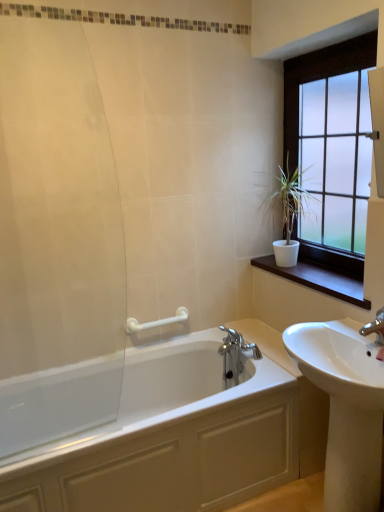
Measure the distance between point (320, 279) and camera.

The depth of point (320, 279) is 6.87 feet.

Measure the distance between white wood at right and camera.

white wood at right and camera are 5.83 feet apart.

Where is `transparent glass shower door at left`? transparent glass shower door at left is located at coordinates (56, 240).

What do you see at coordinates (56, 240) in the screenshot?
I see `transparent glass shower door at left` at bounding box center [56, 240].

Measure the distance between point [327,479] and camera.

Point [327,479] and camera are 1.69 meters apart from each other.

This screenshot has width=384, height=512. I want to click on white plastic grab bar at upper center, so click(x=156, y=321).

The width and height of the screenshot is (384, 512). What do you see at coordinates (170, 439) in the screenshot?
I see `white glossy bathtub at lower left` at bounding box center [170, 439].

Where is `satin glass window at upper right`? The width and height of the screenshot is (384, 512). satin glass window at upper right is located at coordinates (320, 78).

The height and width of the screenshot is (512, 384). Describe the element at coordinates (320, 78) in the screenshot. I see `satin glass window at upper right` at that location.

Locate an element on the screen. white matte plant at upper right is located at coordinates (290, 212).

From a real-world perspective, is white plastic grab bar at upper center physically below white glossy sink at right?

No, from a real-world perspective, white plastic grab bar at upper center is not below white glossy sink at right.

Is white plastic grab bar at upper center in front of or behind white glossy sink at right in the image?

white plastic grab bar at upper center is positioned farther from the viewer than white glossy sink at right.

How much distance is there between satin glass window at upper right and transparent glass shower door at left?

satin glass window at upper right is 4.43 feet from transparent glass shower door at left.

Can we say satin glass window at upper right lies outside transparent glass shower door at left?

Yes, satin glass window at upper right is not within transparent glass shower door at left.

Considering the sizes of objects satin glass window at upper right and transparent glass shower door at left in the image provided, who is shorter, satin glass window at upper right or transparent glass shower door at left?

Standing shorter between the two is satin glass window at upper right.

Is point (304, 67) less distant than point (38, 369)?

No, (304, 67) is further to viewer.

Is white glossy sink at right touching transparent glass shower door at left?

No, white glossy sink at right is not next to transparent glass shower door at left.

From the image's perspective, which one is positioned higher, white glossy sink at right or transparent glass shower door at left?

transparent glass shower door at left is shown above in the image.

Is point (299, 369) positioned in front of point (118, 374)?

Yes, it is in front of point (118, 374).

Between white glossy sink at right and transparent glass shower door at left, which one has larger width?

Wider between the two is white glossy sink at right.

Consider the image. Does satin glass window at upper right have a smaller size compared to white wood at right?

No.

This screenshot has height=512, width=384. I want to click on window sill behind the satin glass window at upper right, so click(318, 280).

Is satin glass window at upper right oriented away from white wood at right?

satin glass window at upper right is not turned away from white wood at right.

Is white wood at right in front of or behind white plastic grab bar at upper center in the image?

white wood at right is in front of white plastic grab bar at upper center.

Would you say white plastic grab bar at upper center is part of white wood at right's contents?

Definitely not — white plastic grab bar at upper center is not inside white wood at right.

How many degrees apart are the facing directions of white wood at right and white plastic grab bar at upper center?

They differ by 91.6 degrees in their facing directions.

From a real-world perspective, is white wood at right located higher than white plastic grab bar at upper center?

Yes, from a real-world perspective, white wood at right is above white plastic grab bar at upper center.

Is white wood at right further to camera compared to satin glass window at upper right?

Yes, white wood at right is further from the viewer.

From a real-world perspective, between white wood at right and satin glass window at upper right, who is vertically lower?

From a 3D spatial view, white wood at right is below.

Can you see white wood at right touching satin glass window at upper right?

white wood at right is not next to satin glass window at upper right, and they're not touching.

Is satin glass window at upper right at the back of white wood at right?

No, white wood at right's orientation is not away from satin glass window at upper right.

Which is more distant, (x=208, y=476) or (x=288, y=251)?

Positioned behind is point (x=288, y=251).

Is white glossy bathtub at lower left touching white matte plant at upper right?

white glossy bathtub at lower left is not next to white matte plant at upper right, and they're not touching.

Looking at this image, is white glossy bathtub at lower left looking in the opposite direction of white matte plant at upper right?

white glossy bathtub at lower left is not turned away from white matte plant at upper right.

Is white glossy bathtub at lower left further to camera compared to white matte plant at upper right?

No.

This screenshot has width=384, height=512. Identify the location of towel bar located above the white glossy sink at right (from a real-world perspective). (156, 321).

You are a GUI agent. You are given a task and a screenshot of the screen. Output one action in this format:
    pyautogui.click(x=<x>, y=<y>)
    Task: Click on the window that is above the transparent glass shower door at left (from the image's perspective)
    
    Given the screenshot: What is the action you would take?
    pyautogui.click(x=320, y=78)

Considering their positions, is white glossy bathtub at lower left positioned closer to white matte plant at upper right than satin glass window at upper right?

satin glass window at upper right is positioned closer to the anchor white matte plant at upper right.

Which object lies further to the anchor point satin glass window at upper right, transparent glass shower door at left or white glossy bathtub at lower left?

The object further to satin glass window at upper right is white glossy bathtub at lower left.

From the image, which object appears to be nearer to white plastic grab bar at upper center, white glossy bathtub at lower left or white wood at right?

white wood at right is closer to white plastic grab bar at upper center.

Consider the image. When comparing their distances from satin glass window at upper right, does white plastic grab bar at upper center or white glossy sink at right seem closer?

Based on the image, white plastic grab bar at upper center appears to be nearer to satin glass window at upper right.

When comparing their distances from white plastic grab bar at upper center, does transparent glass shower door at left or white wood at right seem further?

white wood at right is further to white plastic grab bar at upper center.

Estimate the real-world distances between objects in this image. Which object is further from transparent glass shower door at left, white plastic grab bar at upper center or white wood at right?

The object further to transparent glass shower door at left is white wood at right.

When comparing their distances from transparent glass shower door at left, does white wood at right or satin glass window at upper right seem closer?

white wood at right is positioned closer to the anchor transparent glass shower door at left.

Looking at the image, which one is located further to white plastic grab bar at upper center, white glossy bathtub at lower left or white glossy sink at right?

Based on the image, white glossy sink at right appears to be further to white plastic grab bar at upper center.

Where is `towel bar between transparent glass shower door at left and white wood at right in the horizontal direction`? Image resolution: width=384 pixels, height=512 pixels. towel bar between transparent glass shower door at left and white wood at right in the horizontal direction is located at coordinates (156, 321).

Find the location of a particular element. window sill that lies between white matte plant at upper right and white glossy bathtub at lower left from top to bottom is located at coordinates (318, 280).

Locate an element on the screen. The height and width of the screenshot is (512, 384). houseplant between satin glass window at upper right and white glossy sink at right from top to bottom is located at coordinates (290, 212).

The width and height of the screenshot is (384, 512). Identify the location of bathtub located between transparent glass shower door at left and white plastic grab bar at upper center in the depth direction. (170, 439).